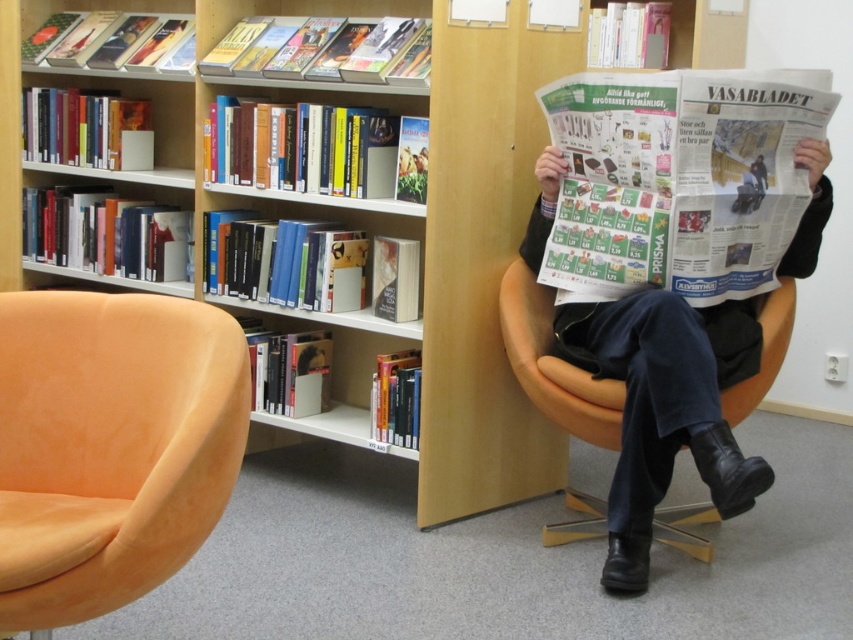
Question: Is suede orange swivel chair at left above orange fabric armchair at center?

Choices:
 (A) no
 (B) yes

Answer: (A)

Question: In this image, where is wooden bookshelf at upper center located relative to suede orange swivel chair at left?

Choices:
 (A) right
 (B) left

Answer: (A)

Question: Which of these objects is positioned farthest from the orange fabric armchair at center?

Choices:
 (A) wooden bookshelf at upper center
 (B) suede orange swivel chair at left

Answer: (B)

Question: Which point is farther to the camera?

Choices:
 (A) orange fabric armchair at center
 (B) wooden bookshelf at upper center
 (C) suede orange swivel chair at left

Answer: (B)

Question: Can you confirm if suede orange swivel chair at left is positioned to the left of orange fabric armchair at center?

Choices:
 (A) yes
 (B) no

Answer: (A)

Question: Which point is closer to the camera taking this photo?

Choices:
 (A) (776, 330)
 (B) (335, 436)

Answer: (A)